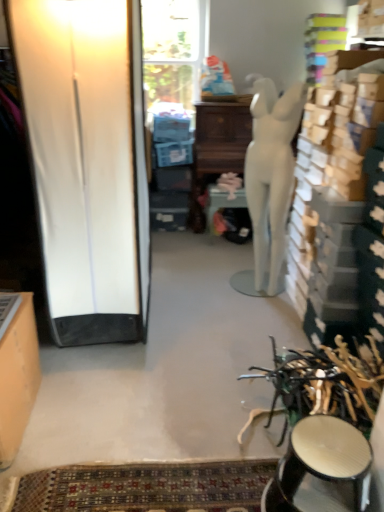
Find the location of a particular element. Image resolution: width=384 pixels, height=512 pixels. free spot above shiny metallic stool at lower right (from a real-world perspective) is located at coordinates (330, 453).